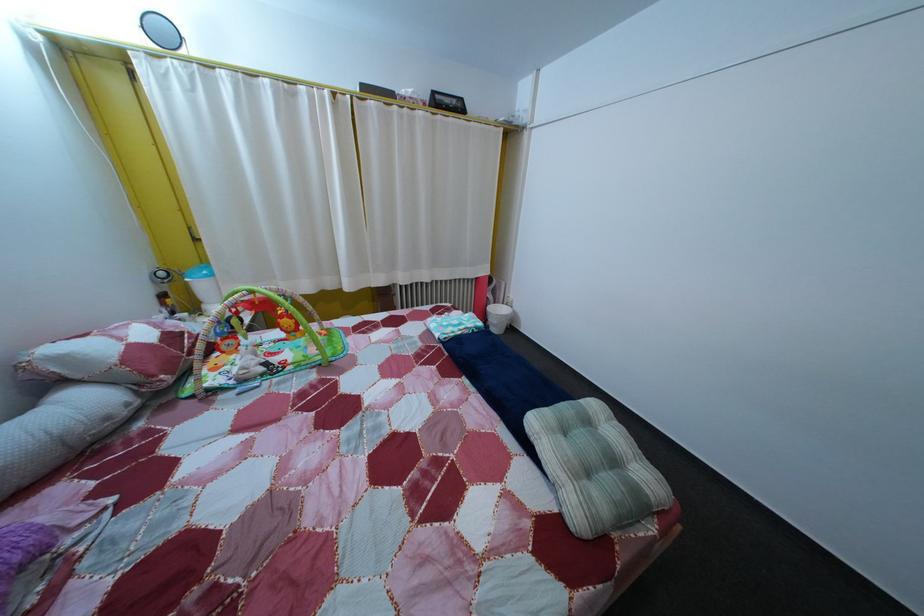
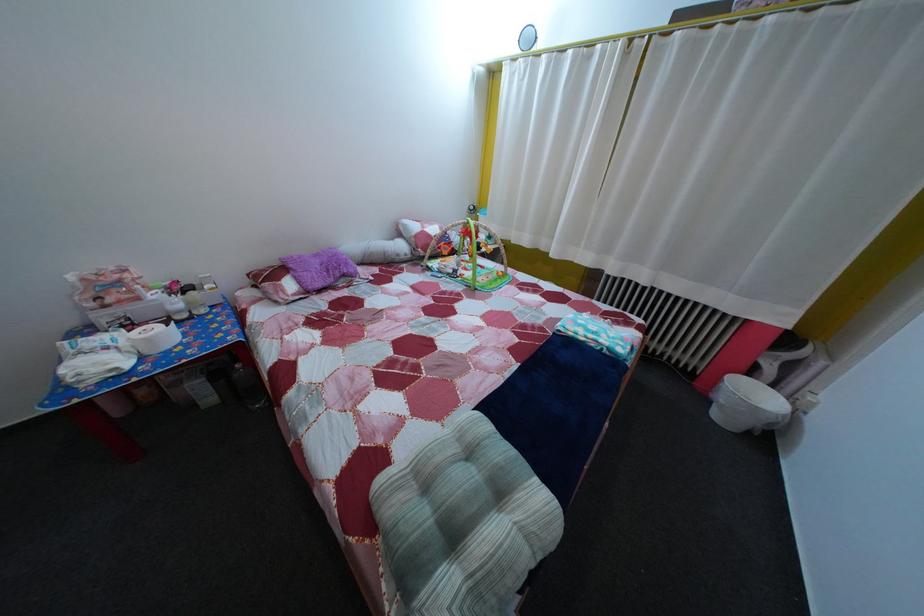
In the second image, find the point that corresponds to pixel 455 339 in the first image.

(578, 334)